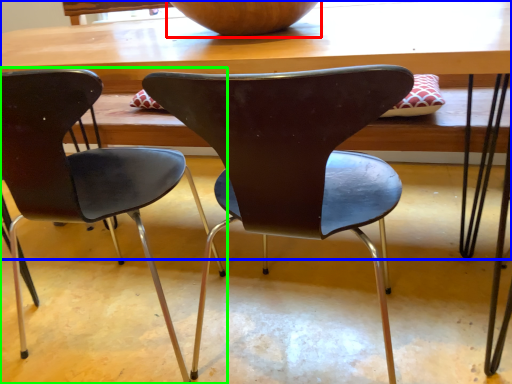
Question: Based on their relative distances, which object is farther from bowl (highlighted by a red box)? Choose from table (highlighted by a blue box) and chair (highlighted by a green box).

Choices:
 (A) table
 (B) chair

Answer: (B)